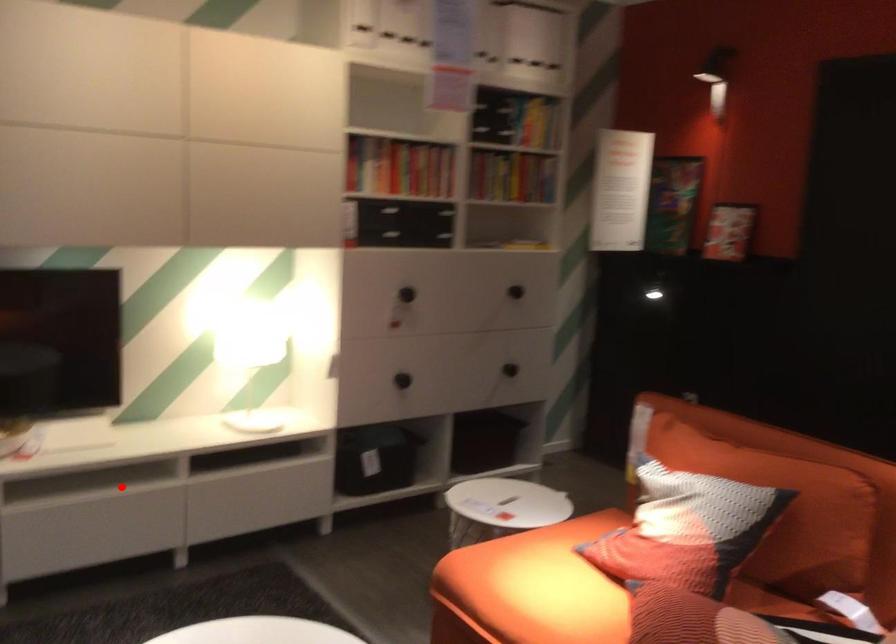
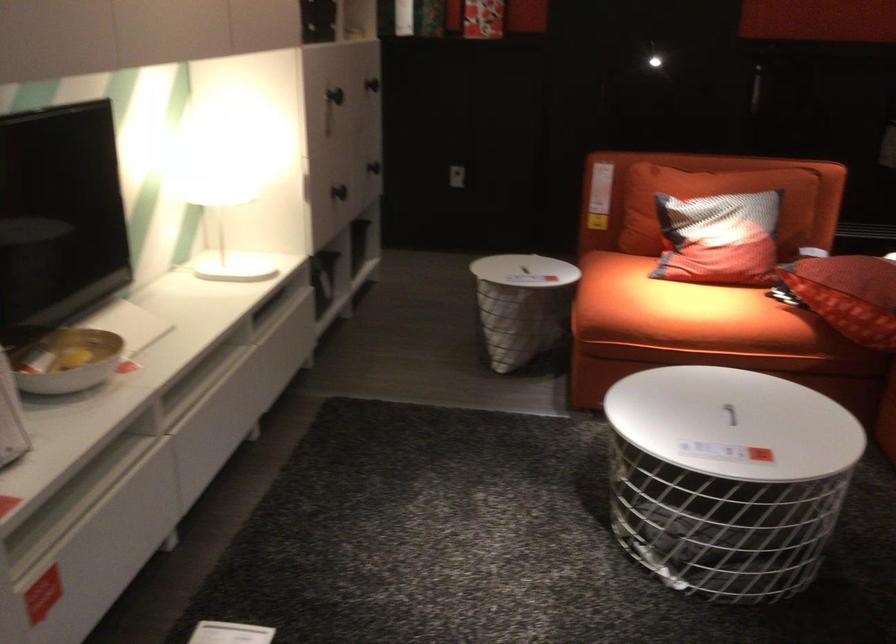
Question: I am providing you with two images of the same scene from different viewpoints. Given a red point in image1, look at the same physical point in image2. Is it:

Choices:
 (A) Closer to the viewpoint
 (B) Farther from the viewpoint

Answer: (A)